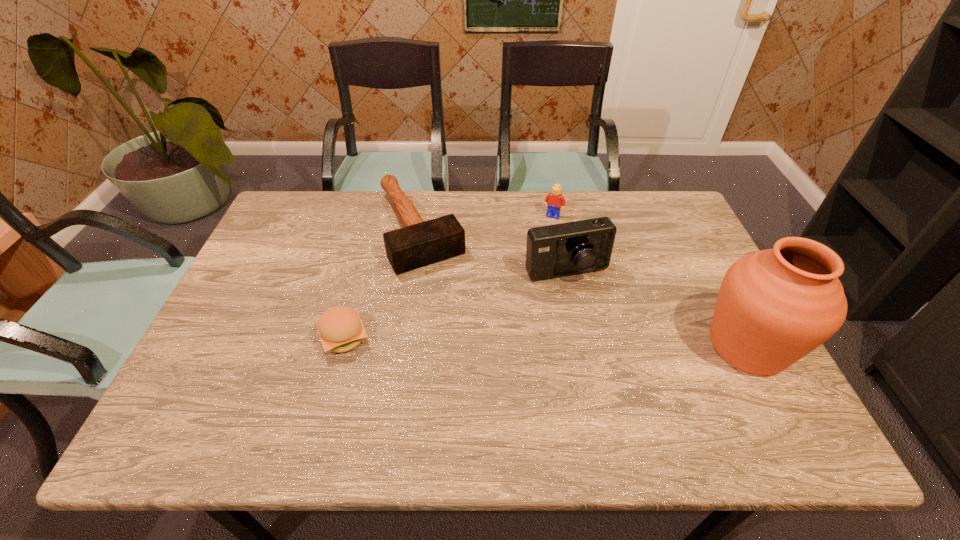
Image resolution: width=960 pixels, height=540 pixels. In order to click on free region that satisfies the following two spatial constraints: 1. on the front side of the mallet; 2. on the left side of the urn in this screenshot , I will do `click(402, 346)`.

You are a GUI agent. You are given a task and a screenshot of the screen. Output one action in this format:
    pyautogui.click(x=<x>, y=<y>)
    Task: Click on the vacant area that satisfies the following two spatial constraints: 1. on the front side of the hamburger; 2. on the left side of the tallest object
    
    Given the screenshot: What is the action you would take?
    pyautogui.click(x=342, y=346)

Identify the location of vacant space that satisfies the following two spatial constraints: 1. on the front side of the Lego; 2. on the right side of the urn. [577, 346].

Locate an element on the screen. The image size is (960, 540). free space that satisfies the following two spatial constraints: 1. on the front side of the third tallest object; 2. on the left side of the urn is located at coordinates (577, 346).

Find the location of a particular element. This screenshot has height=540, width=960. vacant position in the image that satisfies the following two spatial constraints: 1. on the front side of the tallest object; 2. on the right side of the mallet is located at coordinates (402, 346).